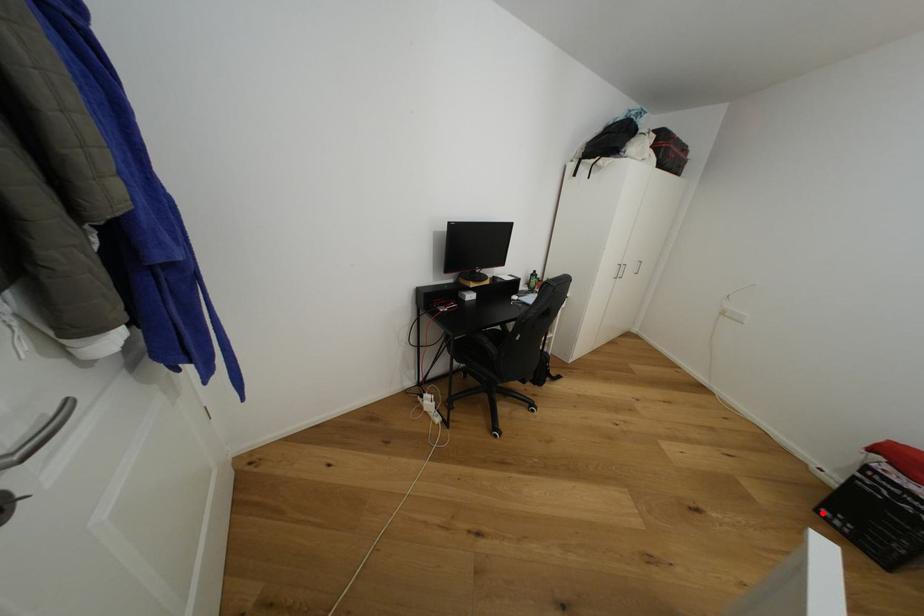
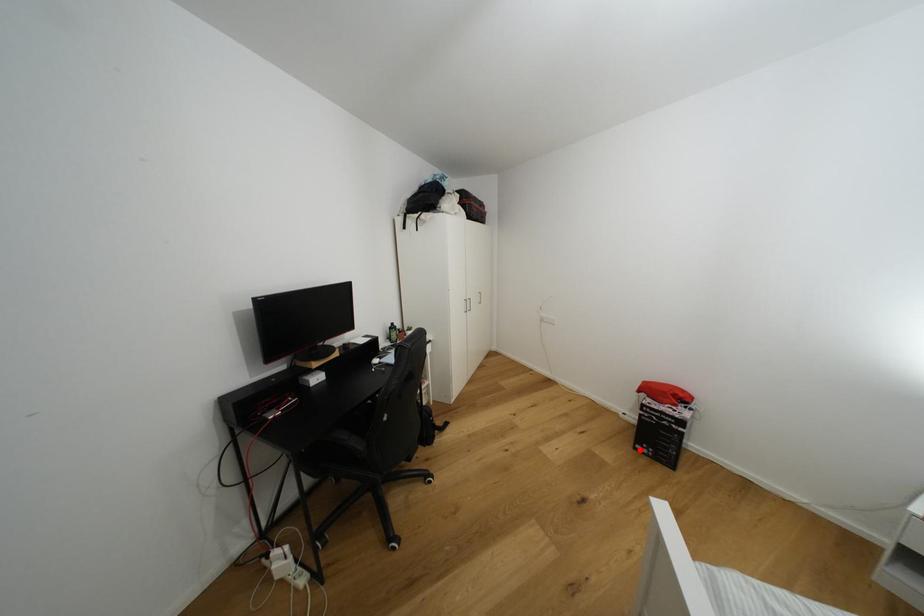
I am providing you with two images of the same scene from different viewpoints. A red point is marked on the first image and another point is marked on the second image. Does the point marked in image1 correspond to the same location as the one in image2?

Yes